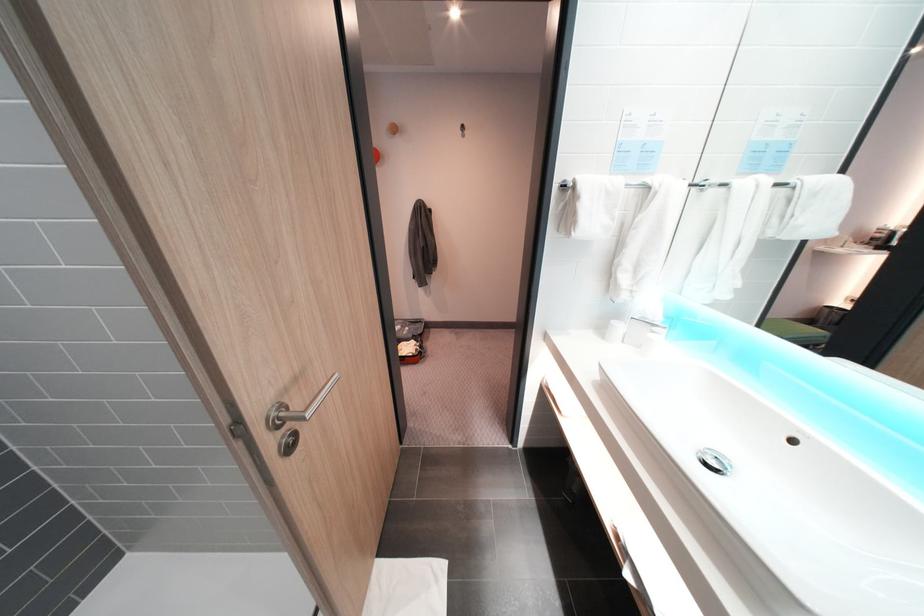
The width and height of the screenshot is (924, 616). I want to click on white tumbler, so click(x=614, y=331).